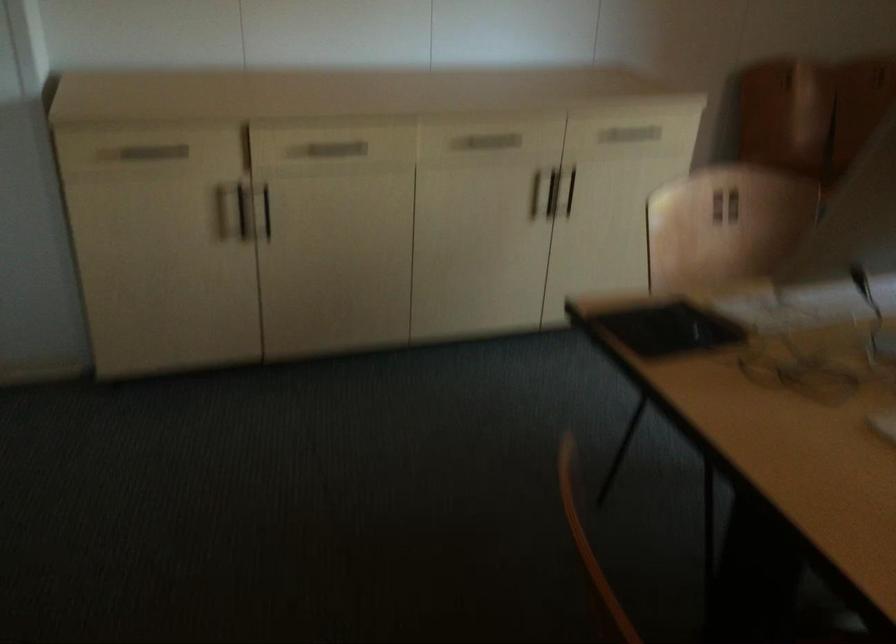
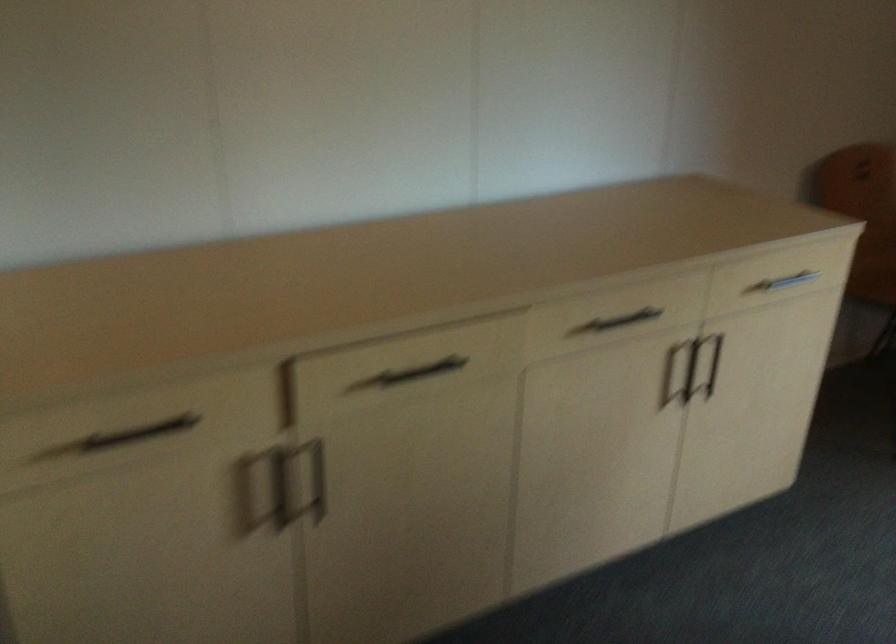
Question: The first image is from the beginning of the video and the second image is from the end. How did the camera likely rotate when shooting the video?

Choices:
 (A) Left
 (B) Right
 (C) Up
 (D) Down

Answer: (B)